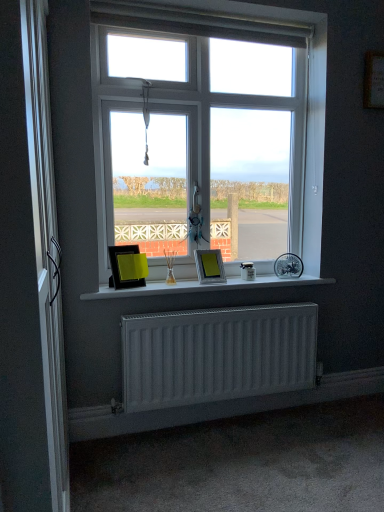
The height and width of the screenshot is (512, 384). In order to click on white matte radiator at lower center in this screenshot , I will do `click(217, 355)`.

At what (x,y) coordinates should I click in order to perform the action: click on white matte window sill at center. Please return your answer as a coordinate pair (x, y). The width and height of the screenshot is (384, 512). Looking at the image, I should click on tap(205, 287).

What do you see at coordinates (205, 287) in the screenshot? The width and height of the screenshot is (384, 512). I see `white matte window sill at center` at bounding box center [205, 287].

The width and height of the screenshot is (384, 512). What do you see at coordinates (210, 266) in the screenshot? I see `metallic silver picture frame at center, which ranks as the 1th picture frame in right-to-left order` at bounding box center [210, 266].

The image size is (384, 512). Describe the element at coordinates (211, 139) in the screenshot. I see `white plastic window at center` at that location.

At what (x,y) coordinates should I click in order to perform the action: click on white matte radiator at lower center. Please return your answer as a coordinate pair (x, y). This screenshot has width=384, height=512. Looking at the image, I should click on (217, 355).

Is silver metallic screen door at left turned away from metallic silver picture frame at center, which ranks as the 1th picture frame in right-to-left order?

No, silver metallic screen door at left is not facing away from metallic silver picture frame at center, which ranks as the 1th picture frame in right-to-left order.

Are silver metallic screen door at left and metallic silver picture frame at center, which ranks as the 1th picture frame in right-to-left order, making contact?

No.

From the picture: From the image's perspective, is silver metallic screen door at left above metallic silver picture frame at center, which ranks as the 1th picture frame in right-to-left order?

Actually, silver metallic screen door at left appears below metallic silver picture frame at center, which ranks as the 1th picture frame in right-to-left order, in the image.

Is point (120, 285) positioned before point (254, 283)?

Yes, point (120, 285) is in front of point (254, 283).

Visually, is matte black picture frame at center, marked as the second picture frame in a right-to-left arrangement, positioned to the left or to the right of white matte window sill at center?

In the image, matte black picture frame at center, marked as the second picture frame in a right-to-left arrangement, appears on the left side of white matte window sill at center.

Locate an element on the screen. The image size is (384, 512). window sill that is under the matte black picture frame at center, marked as the 1th picture frame in a left-to-right arrangement (from a real-world perspective) is located at coordinates (205, 287).

Is matte black picture frame at center, marked as the 1th picture frame in a left-to-right arrangement, in front of or behind white matte window sill at center in the image?

Clearly, matte black picture frame at center, marked as the 1th picture frame in a left-to-right arrangement, is behind white matte window sill at center.

Is white plastic window at center wider or thinner than white matte window sill at center?

In the image, white plastic window at center appears to be more narrow than white matte window sill at center.

Is white plastic window at center placed right next to white matte window sill at center?

They are not placed beside each other.

Identify the location of window above the white matte window sill at center (from the image's perspective). This screenshot has height=512, width=384. (211, 139).

Consider the image. From a real-world perspective, relative to matte black picture frame at center, marked as the second picture frame in a right-to-left arrangement, is white matte window sill at center vertically above or below?

white matte window sill at center is below matte black picture frame at center, marked as the second picture frame in a right-to-left arrangement.

Which point is more forward, (111, 292) or (128, 246)?

The point (111, 292) is closer.

Is white matte window sill at center thinner than matte black picture frame at center, marked as the 1th picture frame in a left-to-right arrangement?

No, white matte window sill at center is not thinner than matte black picture frame at center, marked as the 1th picture frame in a left-to-right arrangement.

Is white matte window sill at center turned away from matte black picture frame at center, marked as the 1th picture frame in a left-to-right arrangement?

No, matte black picture frame at center, marked as the 1th picture frame in a left-to-right arrangement, is not at the back of white matte window sill at center.

Based on the photo, is metallic silver picture frame at center, which ranks as the 1th picture frame in right-to-left order, at the right side of white matte radiator at lower center?

Incorrect, metallic silver picture frame at center, which ranks as the 1th picture frame in right-to-left order, is not on the right side of white matte radiator at lower center.

From the image's perspective, is metallic silver picture frame at center, the second picture frame viewed from the left, under white matte radiator at lower center?

No, from the image's perspective, metallic silver picture frame at center, the second picture frame viewed from the left, is not beneath white matte radiator at lower center.

Considering the points (201, 272) and (280, 366), which point is behind, point (201, 272) or point (280, 366)?

The point (201, 272) is farther.

From the image's perspective, which object appears higher, white matte radiator at lower center or metallic silver picture frame at center, which ranks as the 1th picture frame in right-to-left order?

metallic silver picture frame at center, which ranks as the 1th picture frame in right-to-left order, from the image's perspective.

Which of these two, white matte radiator at lower center or metallic silver picture frame at center, the second picture frame viewed from the left, is thinner?

white matte radiator at lower center.

Does white matte radiator at lower center touch metallic silver picture frame at center, which ranks as the 1th picture frame in right-to-left order?

They are not placed beside each other.

Looking at this image, from a real-world perspective, between white matte radiator at lower center and metallic silver picture frame at center, the second picture frame viewed from the left, who is vertically lower?

From a 3D spatial view, white matte radiator at lower center is below.

You are a GUI agent. You are given a task and a screenshot of the screen. Output one action in this format:
    pyautogui.click(x=<x>, y=<y>)
    Task: Click on the screen door that appears on the left of matte black picture frame at center, marked as the second picture frame in a right-to-left arrangement
    The image size is (384, 512).
    Given the screenshot: What is the action you would take?
    pyautogui.click(x=46, y=243)

Is silver metallic screen door at left thinner than matte black picture frame at center, marked as the 1th picture frame in a left-to-right arrangement?

Yes.

Is point (66, 459) closer to viewer compared to point (122, 248)?

Yes.

Considering the relative sizes of silver metallic screen door at left and matte black picture frame at center, marked as the second picture frame in a right-to-left arrangement, in the image provided, is silver metallic screen door at left smaller than matte black picture frame at center, marked as the second picture frame in a right-to-left arrangement,?

No.

Where is `screen door lying in front of the metallic silver picture frame at center, which ranks as the 1th picture frame in right-to-left order`? The width and height of the screenshot is (384, 512). screen door lying in front of the metallic silver picture frame at center, which ranks as the 1th picture frame in right-to-left order is located at coordinates click(x=46, y=243).

In order to click on the 1st picture frame behind the white matte window sill at center, starting your count from the anchor in this screenshot , I will do `click(117, 266)`.

When comparing their distances from white plastic window at center, does metallic silver picture frame at center, which ranks as the 1th picture frame in right-to-left order, or white matte window sill at center seem closer?

The object closer to white plastic window at center is metallic silver picture frame at center, which ranks as the 1th picture frame in right-to-left order.

When comparing their distances from matte black picture frame at center, marked as the 1th picture frame in a left-to-right arrangement, does silver metallic screen door at left or metallic silver picture frame at center, the second picture frame viewed from the left, seem closer?

metallic silver picture frame at center, the second picture frame viewed from the left, is positioned closer to the anchor matte black picture frame at center, marked as the 1th picture frame in a left-to-right arrangement.

Which object lies further to the anchor point metallic silver picture frame at center, the second picture frame viewed from the left, white plastic window at center or white matte radiator at lower center?

white plastic window at center lies further to metallic silver picture frame at center, the second picture frame viewed from the left, than the other object.

Based on their spatial positions, is white plastic window at center or metallic silver picture frame at center, which ranks as the 1th picture frame in right-to-left order, closer to matte black picture frame at center, marked as the 1th picture frame in a left-to-right arrangement?

The object closer to matte black picture frame at center, marked as the 1th picture frame in a left-to-right arrangement, is metallic silver picture frame at center, which ranks as the 1th picture frame in right-to-left order.

When comparing their distances from white plastic window at center, does white matte radiator at lower center or metallic silver picture frame at center, which ranks as the 1th picture frame in right-to-left order, seem further?

Based on the image, white matte radiator at lower center appears to be further to white plastic window at center.

When comparing their distances from white plastic window at center, does white matte window sill at center or matte black picture frame at center, marked as the second picture frame in a right-to-left arrangement, seem further?

matte black picture frame at center, marked as the second picture frame in a right-to-left arrangement, lies further to white plastic window at center than the other object.

Based on their spatial positions, is matte black picture frame at center, marked as the 1th picture frame in a left-to-right arrangement, or metallic silver picture frame at center, the second picture frame viewed from the left, closer to white matte window sill at center?

metallic silver picture frame at center, the second picture frame viewed from the left, is closer to white matte window sill at center.

Based on their spatial positions, is silver metallic screen door at left or matte black picture frame at center, marked as the second picture frame in a right-to-left arrangement, closer to metallic silver picture frame at center, which ranks as the 1th picture frame in right-to-left order?

Among the two, matte black picture frame at center, marked as the second picture frame in a right-to-left arrangement, is located nearer to metallic silver picture frame at center, which ranks as the 1th picture frame in right-to-left order.

The width and height of the screenshot is (384, 512). Find the location of `window between silver metallic screen door at left and metallic silver picture frame at center, which ranks as the 1th picture frame in right-to-left order, along the z-axis`. window between silver metallic screen door at left and metallic silver picture frame at center, which ranks as the 1th picture frame in right-to-left order, along the z-axis is located at coordinates (211, 139).

Locate an element on the screen. This screenshot has width=384, height=512. window between silver metallic screen door at left and matte black picture frame at center, marked as the second picture frame in a right-to-left arrangement, along the z-axis is located at coordinates (211, 139).

What are the coordinates of `picture frame between white plastic window at center and matte black picture frame at center, marked as the second picture frame in a right-to-left arrangement, from top to bottom` in the screenshot? It's located at (210, 266).

Where is `radiator positioned between silver metallic screen door at left and matte black picture frame at center, marked as the second picture frame in a right-to-left arrangement, from near to far`? Image resolution: width=384 pixels, height=512 pixels. radiator positioned between silver metallic screen door at left and matte black picture frame at center, marked as the second picture frame in a right-to-left arrangement, from near to far is located at coordinates (217, 355).